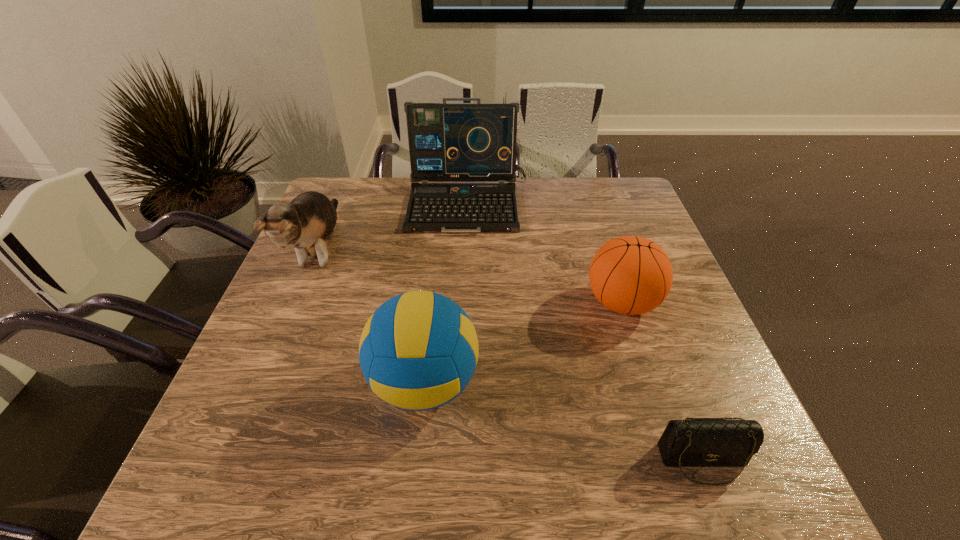
Image resolution: width=960 pixels, height=540 pixels. In the image, there is a desktop. What are the coordinates of `vacant space at the left edge` in the screenshot? It's located at (302, 294).

Where is `vacant space at the right edge of the desktop`? vacant space at the right edge of the desktop is located at coordinates (621, 225).

This screenshot has width=960, height=540. In the image, there is a desktop. Find the location of `vacant space at the near left corner`. vacant space at the near left corner is located at coordinates (276, 470).

Locate an element on the screen. vacant space at the far right corner of the desktop is located at coordinates (647, 217).

In the image, there is a desktop. Identify the location of blank space at the near right corner. Image resolution: width=960 pixels, height=540 pixels. (732, 491).

Where is `free spot between the clutch bag and the leftmost object`? This screenshot has height=540, width=960. free spot between the clutch bag and the leftmost object is located at coordinates coord(511,355).

The width and height of the screenshot is (960, 540). What are the coordinates of `free space between the shortest object and the cat` in the screenshot? It's located at (511, 355).

At what (x,y) coordinates should I click in order to perform the action: click on vacant point located between the shortest object and the fourth tallest object. Please return your answer as a coordinate pair (x, y). This screenshot has height=540, width=960. Looking at the image, I should click on (662, 381).

Where is `free space between the laptop computer and the shortest object`? This screenshot has width=960, height=540. free space between the laptop computer and the shortest object is located at coordinates (586, 333).

Find the location of `free spot between the fourth tallest object and the clutch bag`. free spot between the fourth tallest object and the clutch bag is located at coordinates pos(662,381).